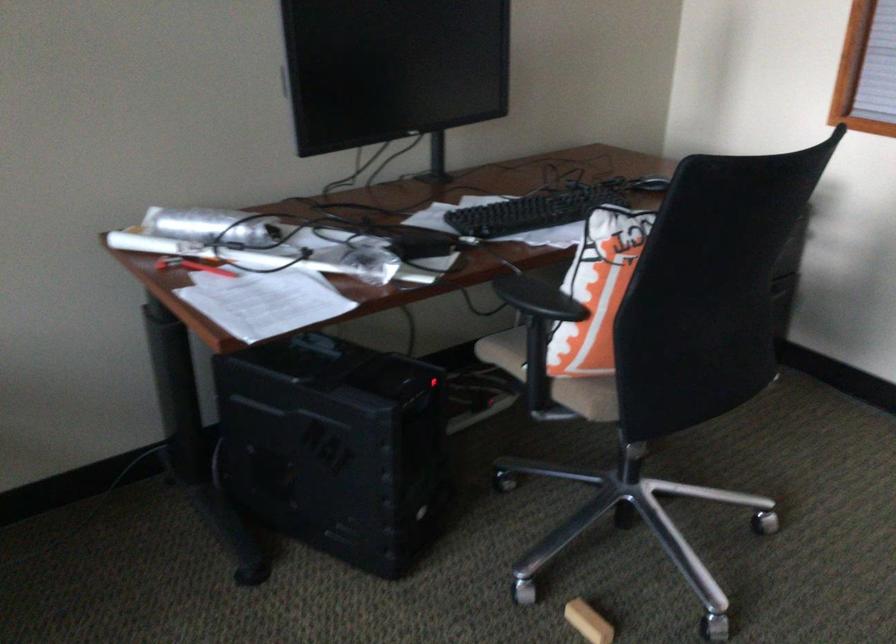
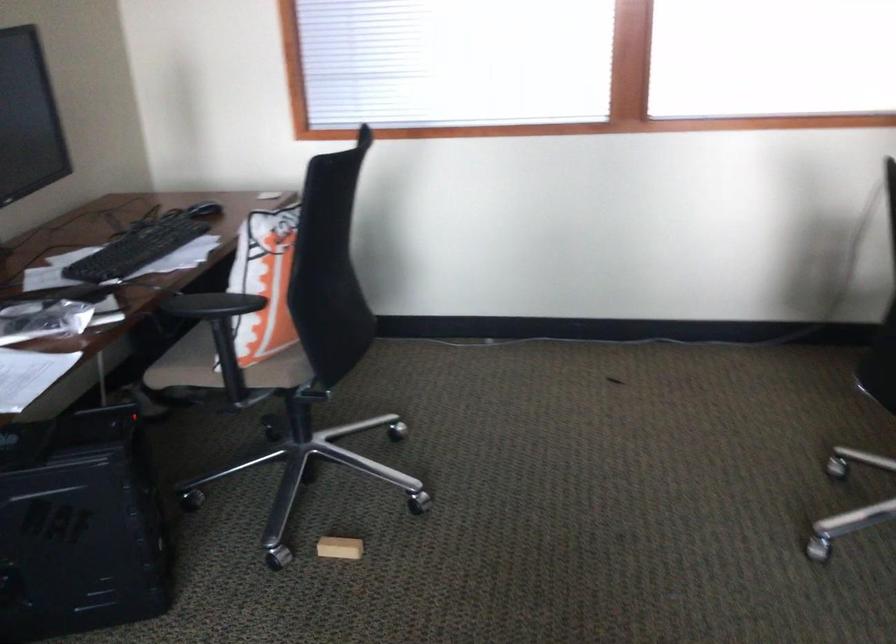
Locate, in the second image, the point that corresponds to point 521,210 in the first image.

(138, 248)